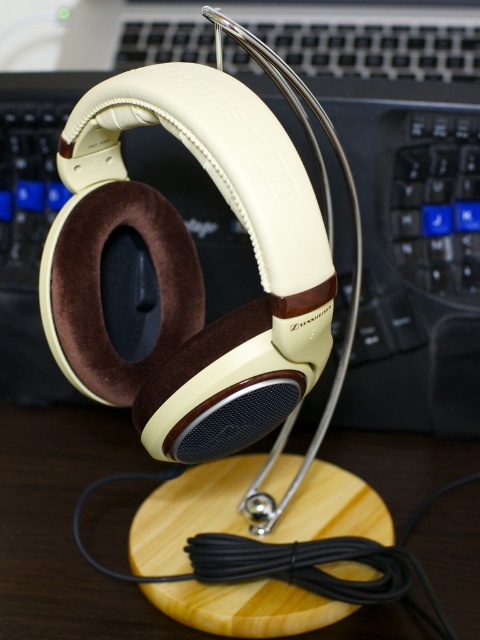
Is matte cream leather headphones at center to the left of wooden table at center from the viewer's perspective?

Incorrect, matte cream leather headphones at center is not on the left side of wooden table at center.

Which is in front, point (372, 100) or point (159, 625)?

Point (159, 625)

Where is `matte cream leather headphones at center`? matte cream leather headphones at center is located at coordinates (400, 193).